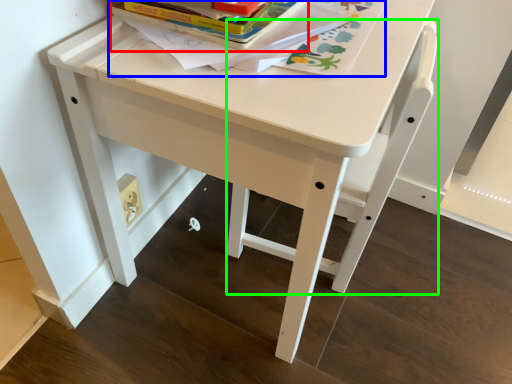
Question: Which is nearer to the paperback book (highlighted by a red box)? book (highlighted by a blue box) or chair (highlighted by a green box).

Choices:
 (A) book
 (B) chair

Answer: (A)